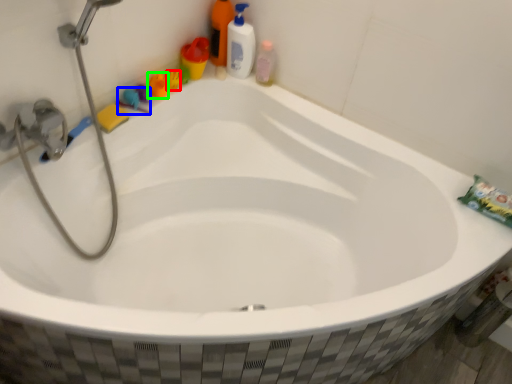
Question: Based on their relative distances, which object is nearer to toy (highlighted by a red box)? Choose from toy (highlighted by a blue box) and toy (highlighted by a green box).

Choices:
 (A) toy
 (B) toy

Answer: (B)